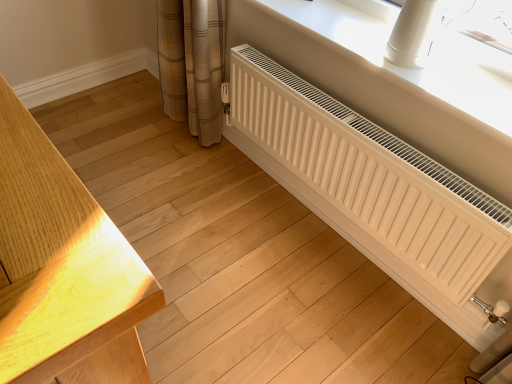
At what (x,y) coordinates should I click in order to perform the action: click on free space below white matte radiator at lower right (from a real-world perspective). Please return your answer as a coordinate pair (x, y). The height and width of the screenshot is (384, 512). Looking at the image, I should click on (308, 220).